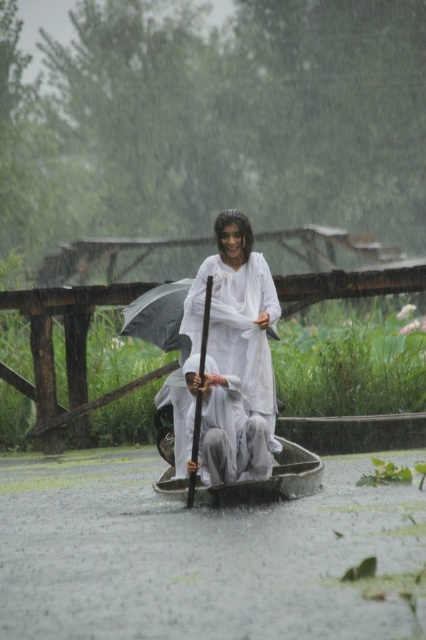
You are standing at the camera position and want to reach point (259, 314). Is the distance less than 50 feet?

The distance between point (259, 314) and the camera is 42.46 feet, which is less than 50 feet. Yes, you can reach it within that distance.

You are a photographer trying to capture the scene while standing on the dock. You notice the white matte cloth at center and the white cotton man at center. Which object should you focus on to ensure it fills more of your camera frame?

The white matte cloth at center is larger in size than the white cotton man at center, so focusing on the white matte cloth at center will fill more of the camera frame.